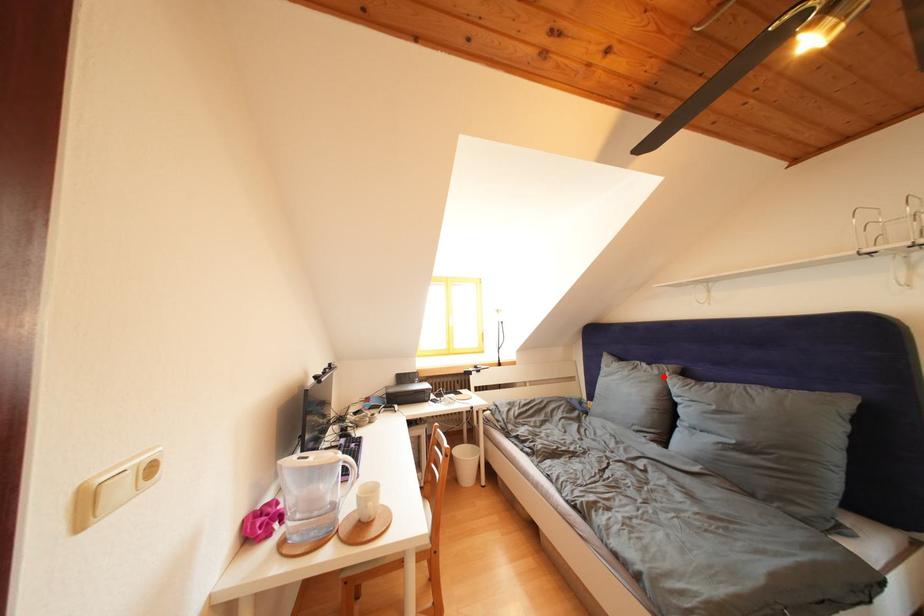
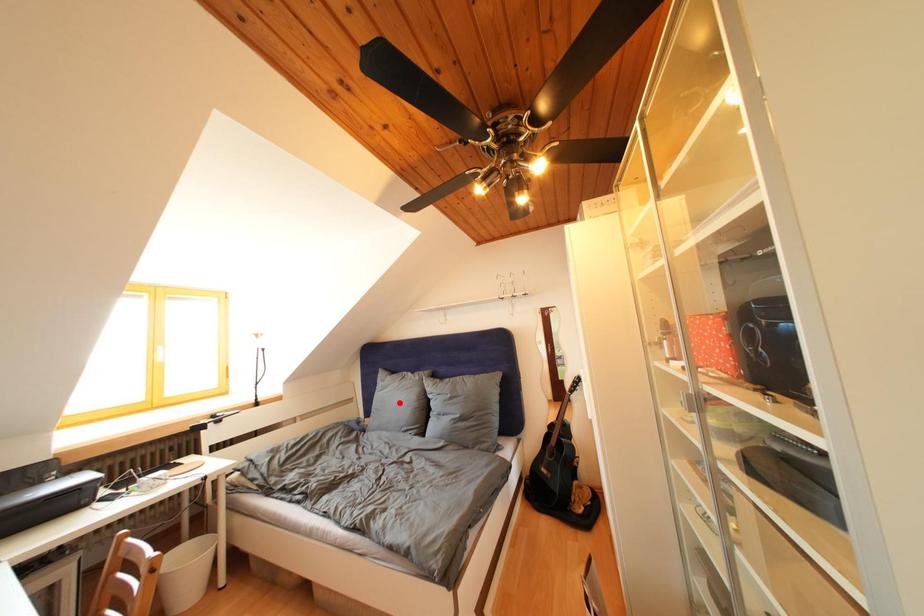
I am providing you with two images of the same scene from different viewpoints. A red point is marked on the first image and another point is marked on the second image. Is the marked point in image1 the same physical position as the marked point in image2?

No